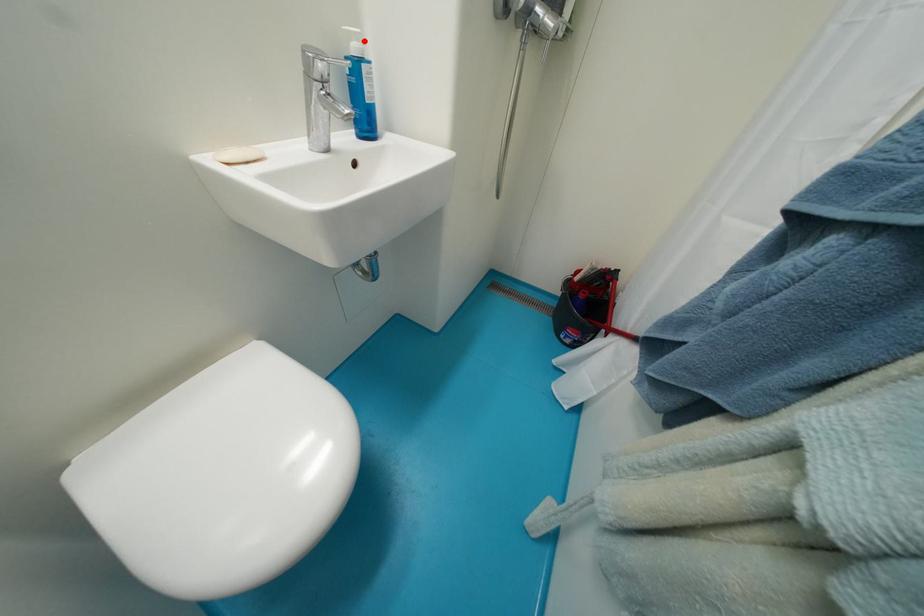
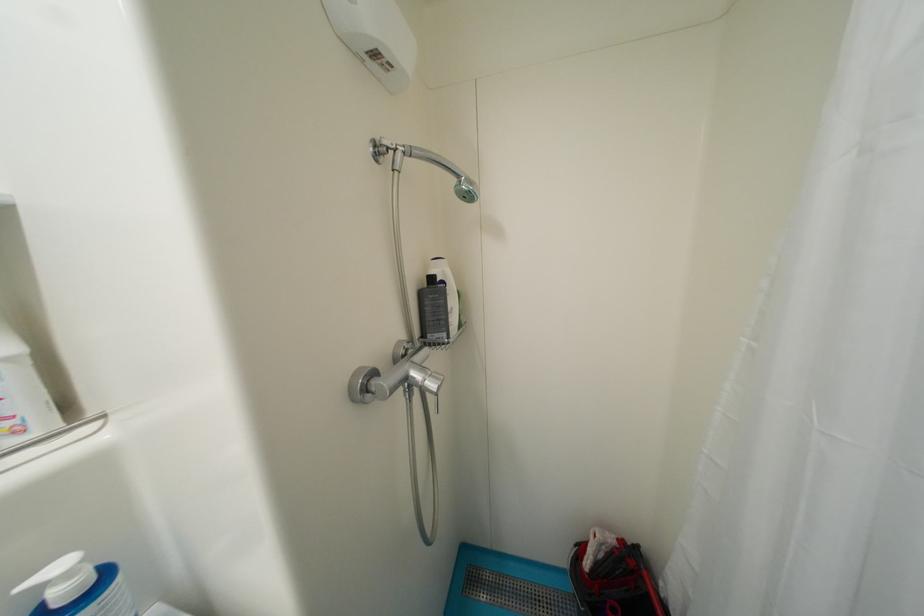
The point at the highlighted location is marked in the first image. Where is the corresponding point in the second image?

(75, 576)